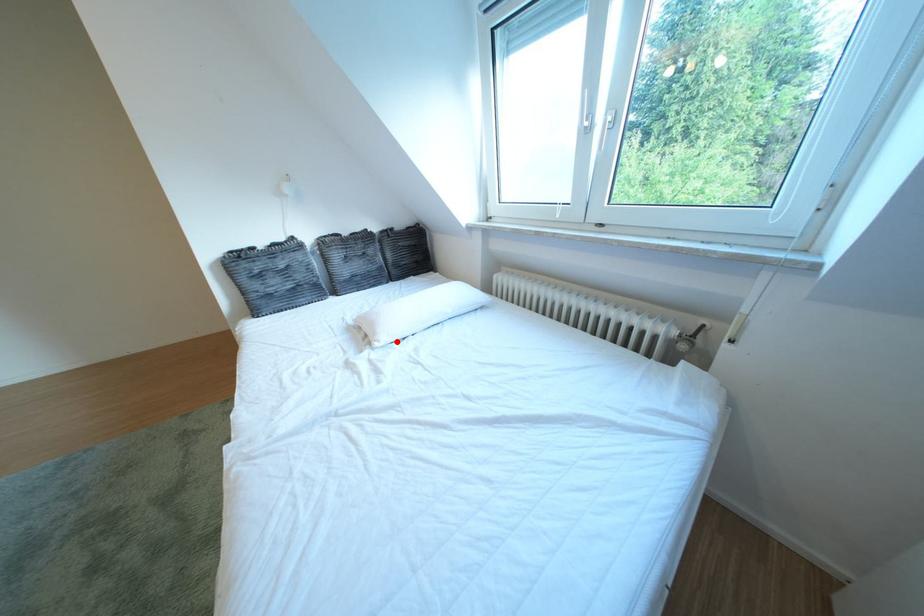
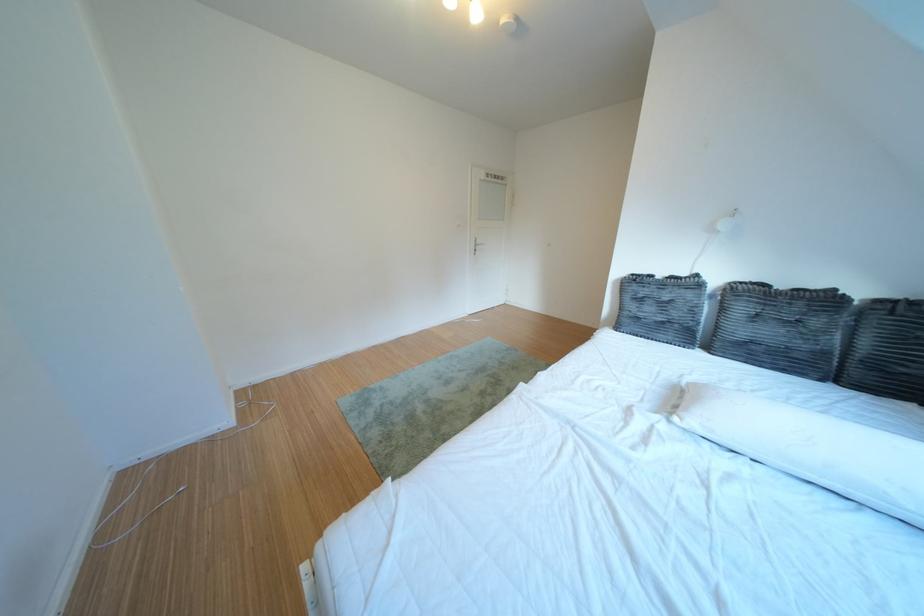
Question: I am providing you with two images of the same scene from different viewpoints. Image1 has a red point marked. In image2, the corresponding 3D location appears at what relative position? Reply with the corresponding letter.

Choices:
 (A) Closer
 (B) Farther

Answer: (B)